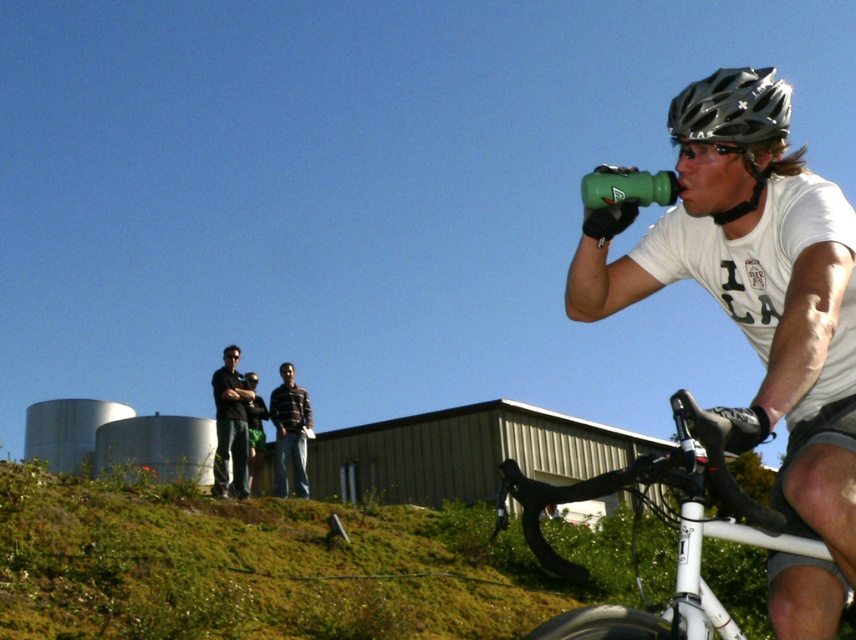
You are a cyclist who just finished a long ride and need to refill your green matte water bottle at right. There is a water fountain located at point (758, 308). Can you reach the water fountain from your current position?

The point (758, 308) is on the green matte water bottle at right, so the water fountain is located at the same position as your water bottle. You can easily reach it without moving far.

You are a photographer trying to capture a photo of the striped cotton shirt at center while also including the white matte bicycle at lower right in the frame. Based on their positions, will you need to adjust your camera angle upwards or downwards to include both?

The white matte bicycle at lower right is above the striped cotton shirt at center, so you will need to adjust your camera angle downwards to include both.

You are a photographer planning to take a picture of the white matte bicycle at lower right and the striped cotton shirt at center. Since you want both objects to appear equally prominent in the photo, which object should you zoom in on more?

The white matte bicycle at lower right is thinner than the striped cotton shirt at center, so you should zoom in more on the white matte bicycle at lower right to make it appear larger and balance its prominence with the striped cotton shirt at center.